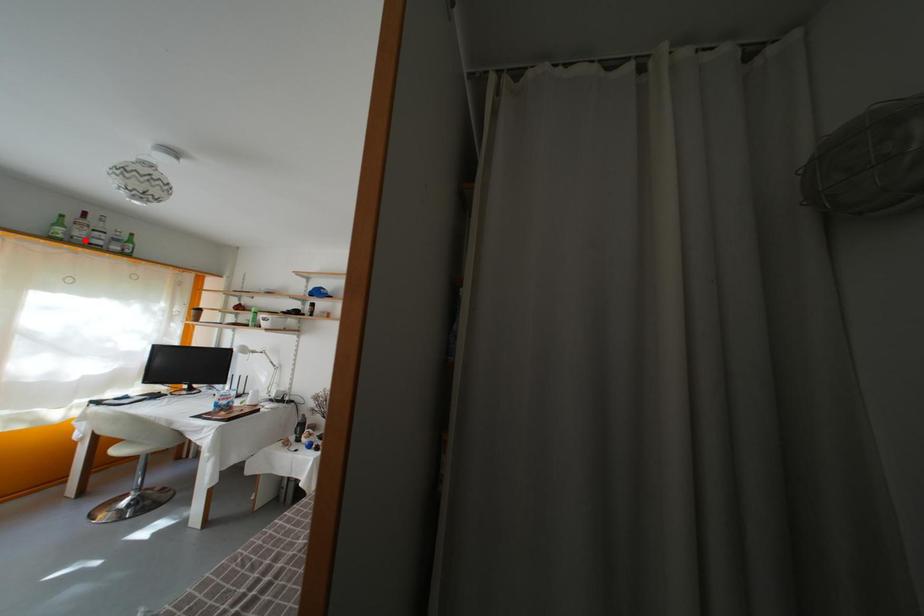
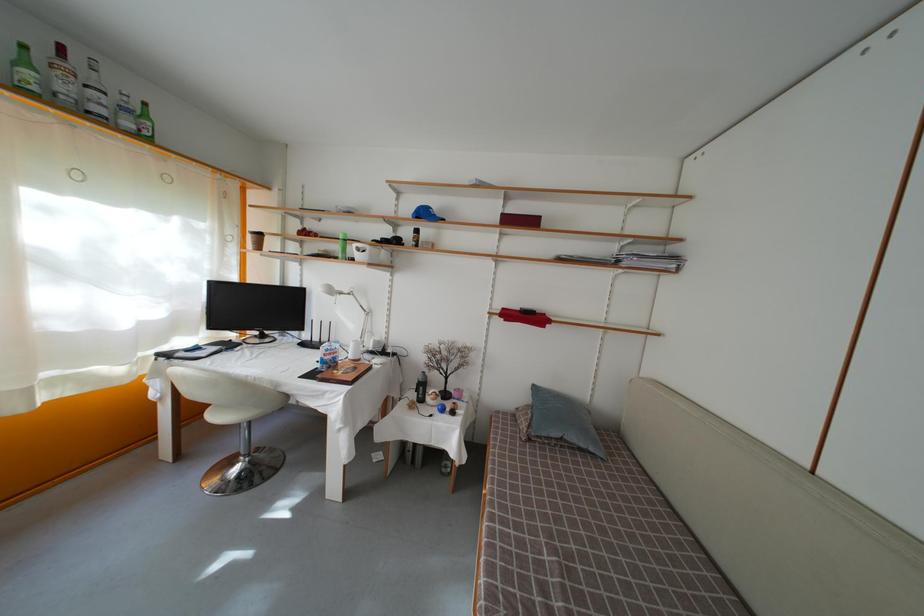
The point at the highlighted location is marked in the first image. Where is the corresponding point in the second image?

(69, 95)